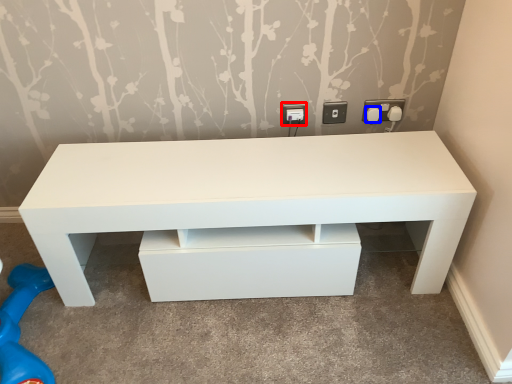
Question: Which object is closer to the camera taking this photo, electric outlet (highlighted by a red box) or knob (highlighted by a blue box)?

Choices:
 (A) electric outlet
 (B) knob

Answer: (B)